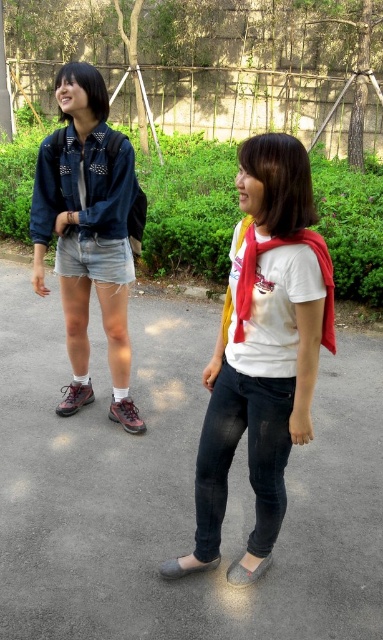
You are a GUI agent. You are given a task and a screenshot of the screen. Output one action in this format:
    pyautogui.click(x=<x>, y=<y>)
    Task: Click on the denim jeans at center
    
    Given the screenshot: What is the action you would take?
    pyautogui.click(x=265, y=342)

Does point (297, 168) come behind point (243, 566)?

No.

Between point (276, 234) and point (232, 579), which one is positioned behind?

Positioned behind is point (232, 579).

This screenshot has height=640, width=383. In order to click on denim jeans at center in this screenshot , I will do `click(265, 342)`.

Between denim shorts at left and gray fabric sandal at lower center, which one is positioned higher?

denim shorts at left is above.

Is denim shorts at left below gray fabric sandal at lower center?

Incorrect, denim shorts at left is not positioned below gray fabric sandal at lower center.

Is point (78, 125) in front of point (229, 570)?

No, it is not.

Locate an element on the screen. The width and height of the screenshot is (383, 640). denim shorts at left is located at coordinates (88, 230).

Can you confirm if denim jeans at center is positioned to the left of denim shorts at left?

In fact, denim jeans at center is to the right of denim shorts at left.

Is point (268, 497) in front of point (88, 116)?

Yes, it is in front of point (88, 116).

At what (x,y) coordinates should I click in order to perform the action: click on denim jeans at center. Please return your answer as a coordinate pair (x, y). Image resolution: width=383 pixels, height=640 pixels. Looking at the image, I should click on (265, 342).